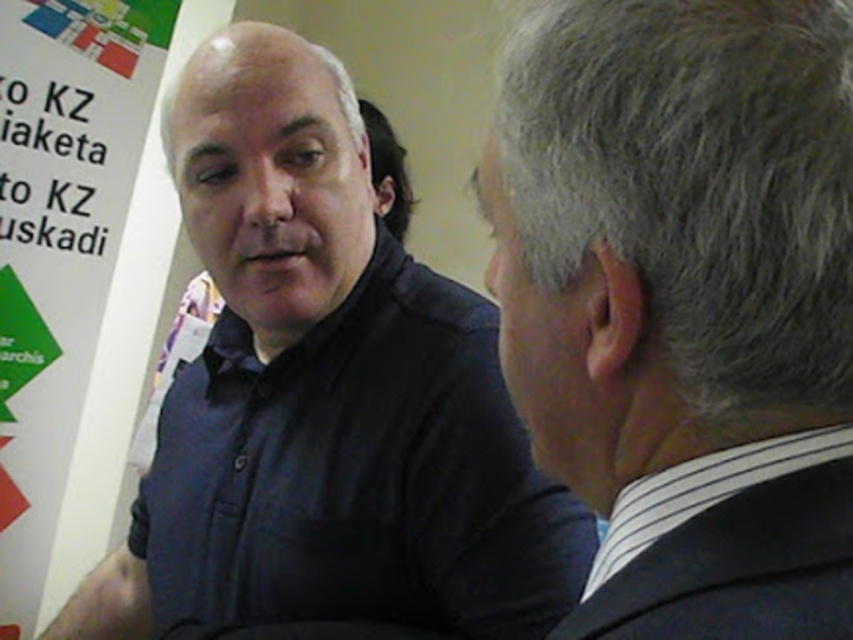
Which is more to the left, matte black shirt at center or white striped shirt at right?

From the viewer's perspective, matte black shirt at center appears more on the left side.

Does matte black shirt at center have a larger size compared to white striped shirt at right?

Yes, matte black shirt at center is bigger than white striped shirt at right.

The width and height of the screenshot is (853, 640). Describe the element at coordinates (325, 394) in the screenshot. I see `matte black shirt at center` at that location.

Where is `matte black shirt at center`? matte black shirt at center is located at coordinates (325, 394).

In the scene shown: Is matte black shirt at center positioned before white paper at left?

Yes.

Is point (357, 477) less distant than point (120, 378)?

Yes.

I want to click on matte black shirt at center, so click(325, 394).

Is the position of white paper at left more distant than that of white striped shirt at right?

That is True.

Does white paper at left have a lesser height compared to white striped shirt at right?

No, white paper at left is not shorter than white striped shirt at right.

Who is more forward, (164, 26) or (645, 544)?

Positioned in front is point (645, 544).

Locate an element on the screen. This screenshot has height=640, width=853. white paper at left is located at coordinates (62, 253).